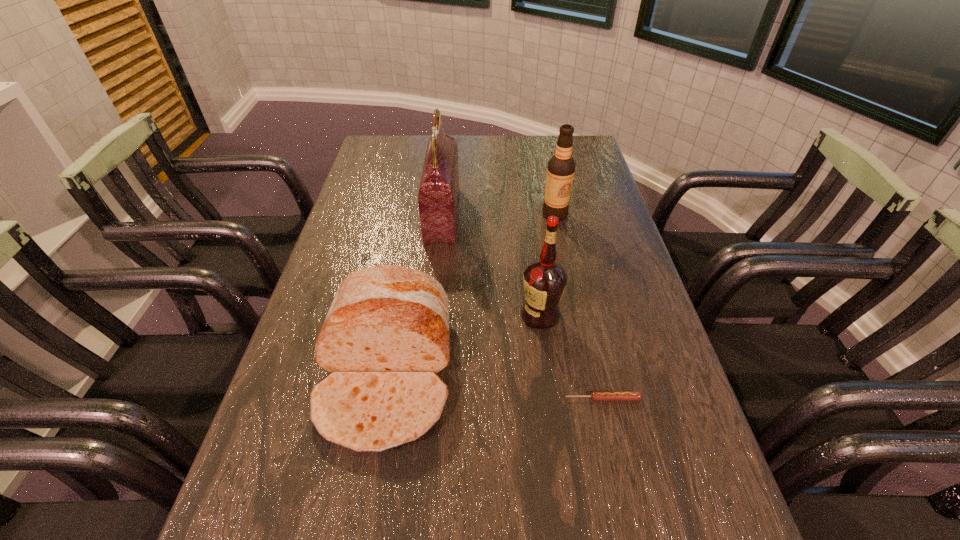
The image size is (960, 540). In order to click on vacant space that satisfies the following two spatial constraints: 1. on the label of the farther alcohol; 2. on the front-facing side of the handbag in this screenshot , I will do `click(555, 215)`.

The height and width of the screenshot is (540, 960). What are the coordinates of `free region that satisfies the following two spatial constraints: 1. on the label of the farther alcohol; 2. on the front-facing side of the handbag` in the screenshot? It's located at (555, 215).

This screenshot has width=960, height=540. Identify the location of vacant region that satisfies the following two spatial constraints: 1. on the label of the nearer alcohol; 2. on the back side of the sausage. (551, 399).